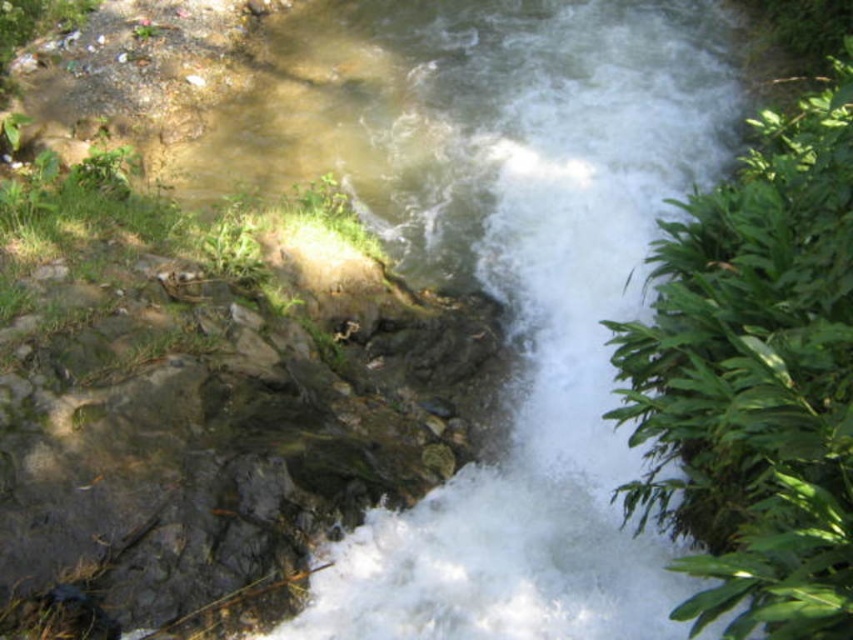
Question: Which of the following is the closest to the observer?

Choices:
 (A) green leafy plant at right
 (B) clear water at center

Answer: (A)

Question: Does clear water at center have a larger size compared to green leafy plant at right?

Choices:
 (A) no
 (B) yes

Answer: (B)

Question: Which object is closer to the camera taking this photo?

Choices:
 (A) green leafy plant at right
 (B) clear water at center

Answer: (A)

Question: Among these points, which one is farthest from the camera?

Choices:
 (A) (601, 154)
 (B) (761, 232)

Answer: (A)

Question: Does clear water at center have a lesser width compared to green leafy plant at right?

Choices:
 (A) yes
 (B) no

Answer: (B)

Question: Can you confirm if clear water at center is positioned above green leafy plant at right?

Choices:
 (A) yes
 (B) no

Answer: (A)